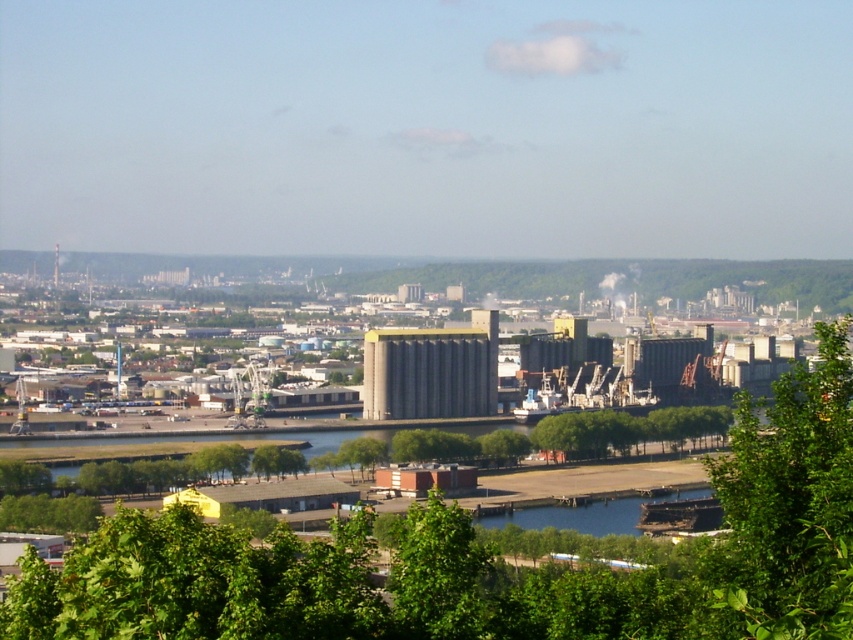
Question: Is green leafy tree at lower center bigger than green leafy tree at lower left?

Choices:
 (A) yes
 (B) no

Answer: (A)

Question: Which object appears farthest from the camera in this image?

Choices:
 (A) green leafy tree at lower left
 (B) green leafy tree at lower right
 (C) gray concrete silos at center
 (D) green leafy tree at center

Answer: (A)

Question: Which object appears farthest from the camera in this image?

Choices:
 (A) green leafy tree at lower right
 (B) green leafy tree at lower center

Answer: (A)

Question: Can you confirm if green leafy tree at lower right is positioned above green leafy tree at center?

Choices:
 (A) yes
 (B) no

Answer: (B)

Question: Does green leafy tree at lower right have a lesser width compared to green leafy tree at lower center?

Choices:
 (A) yes
 (B) no

Answer: (B)

Question: Considering the real-world distances, which object is closest to the green leafy tree at lower left?

Choices:
 (A) gray concrete silos at center
 (B) green leafy tree at lower right
 (C) green leafy tree at center

Answer: (C)